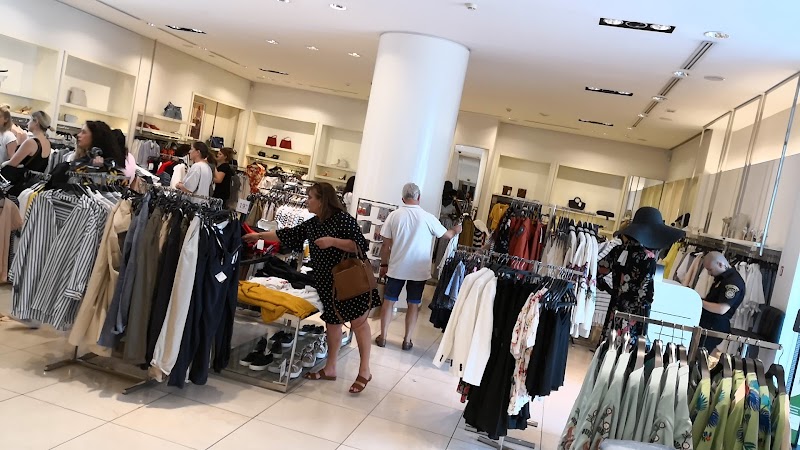
Identify the location of mannequins. (630, 273), (449, 200).